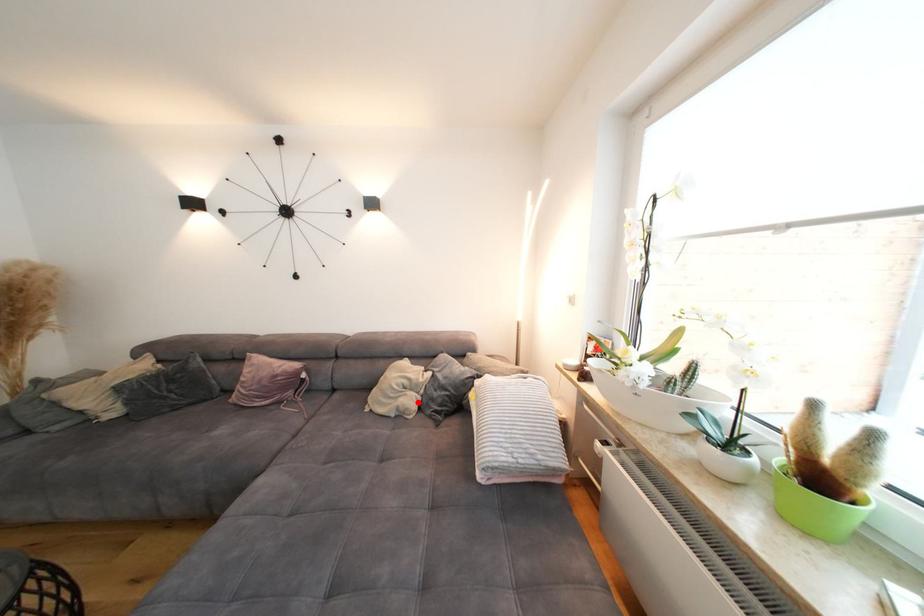
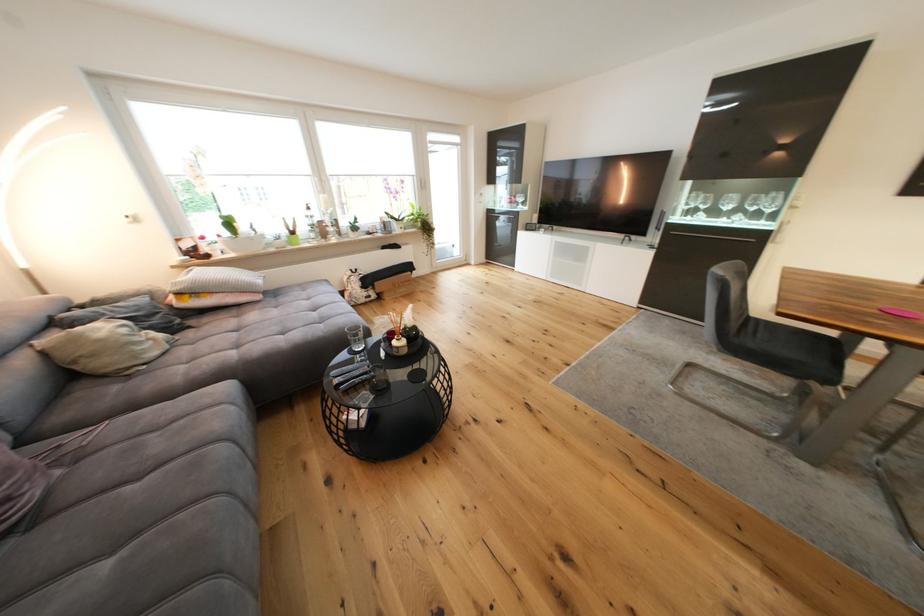
Question: A red point is marked in image1. In image2, is the corresponding 3D point closer to the camera or farther? Reply with the corresponding letter.

Choices:
 (A) The corresponding 3D point is closer.
 (B) The corresponding 3D point is farther.

Answer: (A)